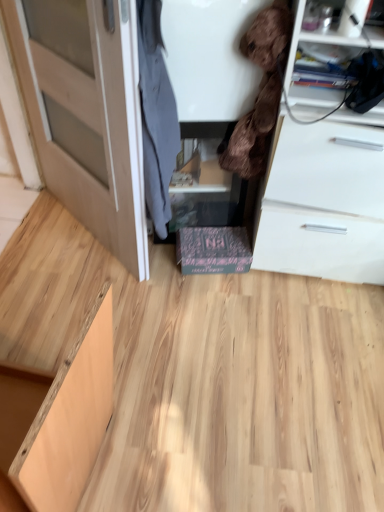
Question: Considering the relative positions of light wood cabinet at lower left, the 2th cabinetry in the back-to-front sequence, and light brown wood door at left in the image provided, is light wood cabinet at lower left, the 2th cabinetry in the back-to-front sequence, to the left of light brown wood door at left from the viewer's perspective?

Choices:
 (A) yes
 (B) no

Answer: (B)

Question: Is light wood cabinet at lower left, which ranks as the first cabinetry in left-to-right order, in front of light brown wood door at left?

Choices:
 (A) no
 (B) yes

Answer: (B)

Question: Is the surface of light wood cabinet at lower left, acting as the first cabinetry starting from the front, in direct contact with light brown wood door at left?

Choices:
 (A) no
 (B) yes

Answer: (A)

Question: Considering the relative sizes of light wood cabinet at lower left, which is the second cabinetry from right to left, and light brown wood door at left in the image provided, is light wood cabinet at lower left, which is the second cabinetry from right to left, bigger than light brown wood door at left?

Choices:
 (A) no
 (B) yes

Answer: (B)

Question: Is light brown wood door at left surrounded by light wood cabinet at lower left, acting as the first cabinetry starting from the front?

Choices:
 (A) no
 (B) yes

Answer: (A)

Question: Based on their positions, is brown plush toy at upper right, acting as the first clothing starting from the right, located to the left or right of natural wood plywood at center?

Choices:
 (A) left
 (B) right

Answer: (B)

Question: Is point (246, 125) positioned closer to the camera than point (163, 286)?

Choices:
 (A) farther
 (B) closer

Answer: (B)

Question: Do you think brown plush toy at upper right, acting as the first clothing starting from the right, is within natural wood plywood at center, or outside of it?

Choices:
 (A) outside
 (B) inside

Answer: (A)

Question: Is brown plush toy at upper right, the second clothing positioned from the left, taller or shorter than natural wood plywood at center?

Choices:
 (A) short
 (B) tall

Answer: (B)

Question: Relative to dark gray fabric coat at center, which is the 2th clothing from right to left, is natural wood plywood at center in front or behind?

Choices:
 (A) behind
 (B) front

Answer: (A)

Question: In terms of size, does natural wood plywood at center appear bigger or smaller than dark gray fabric coat at center, positioned as the 1th clothing in left-to-right order?

Choices:
 (A) big
 (B) small

Answer: (A)

Question: In terms of height, does natural wood plywood at center look taller or shorter compared to dark gray fabric coat at center, which is the 2th clothing from right to left?

Choices:
 (A) short
 (B) tall

Answer: (A)

Question: Does point (334, 364) appear closer or farther from the camera than point (157, 98)?

Choices:
 (A) closer
 (B) farther

Answer: (B)

Question: Is black cardboard box at center, the first cabinetry from the back, in front of or behind dark gray fabric coat at center, which is the 2th clothing from right to left, in the image?

Choices:
 (A) behind
 (B) front

Answer: (A)

Question: Considering the positions of black cardboard box at center, positioned as the second cabinetry in left-to-right order, and dark gray fabric coat at center, which is the 2th clothing from right to left, in the image, is black cardboard box at center, positioned as the second cabinetry in left-to-right order, taller or shorter than dark gray fabric coat at center, which is the 2th clothing from right to left,?

Choices:
 (A) short
 (B) tall

Answer: (A)